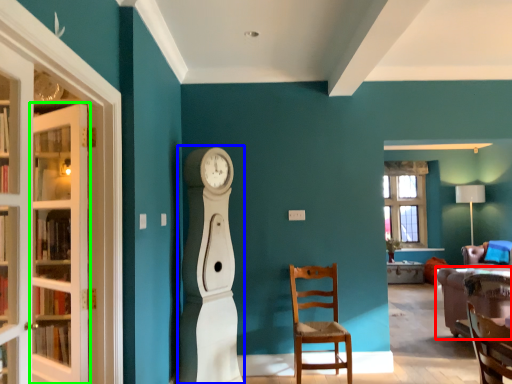
Question: Estimate the real-world distances between objects in this image. Which object is closer to studio couch (highlighted by a red box), open (highlighted by a blue box) or door (highlighted by a green box)?

Choices:
 (A) open
 (B) door

Answer: (A)